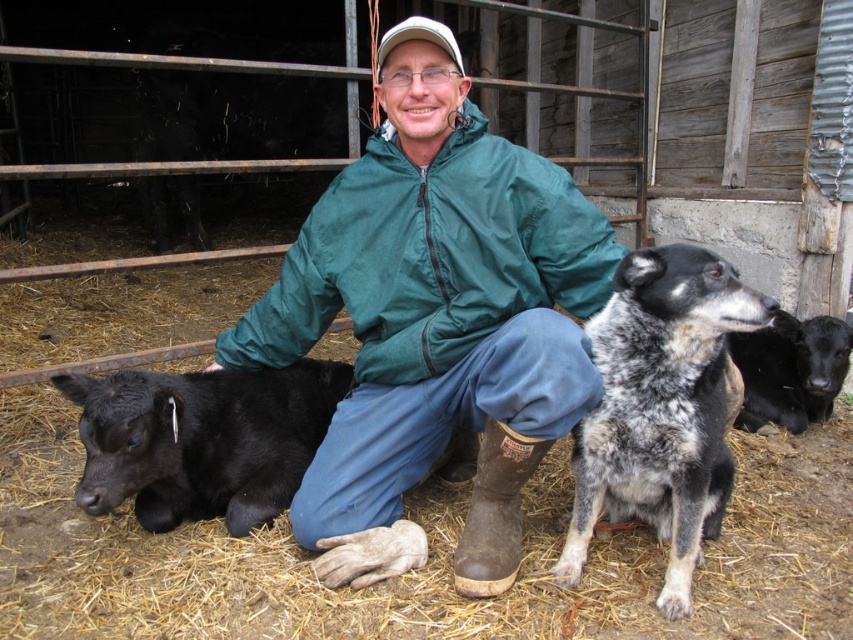
From the picture: Based on the scene description, can you determine which object is located lower in the image between the spotted fur dog at center and the black fur calf at lower left?

The black fur calf at lower left is positioned lower in the image than the spotted fur dog at center.

You are standing in the farm scene and want to place a small flag at each of the two points labeled point (175, 378) and point (776, 422). Which point will require you to walk further back to reach?

Point (776, 422) is further away from the viewer than point (175, 378), so you will need to walk further back to reach point (776, 422).

You are a farmer who wants to know which animal is wider between the spotted fur dog at center and the black fur calf at lower left. Which one is wider?

The spotted fur dog at center is wider than the black fur calf at lower left.